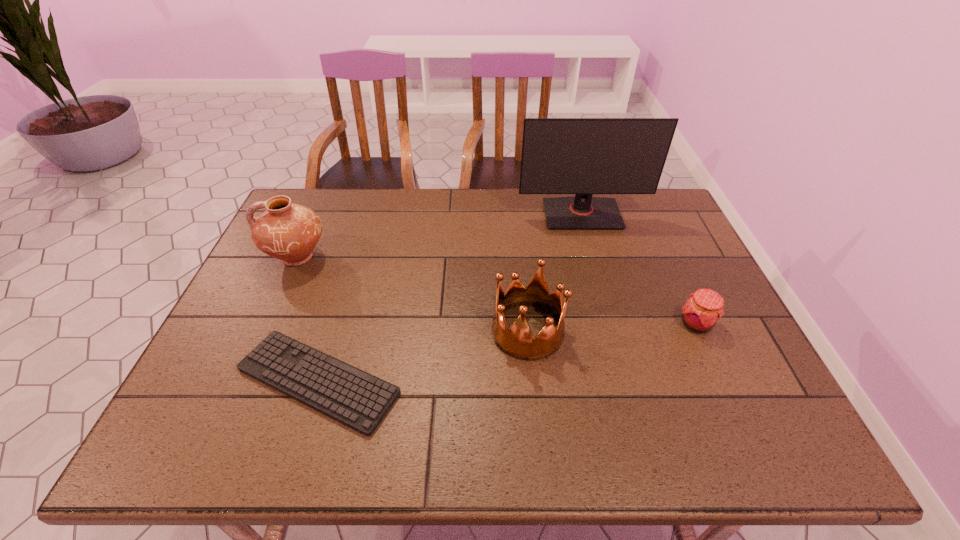
I want to click on object present at the far edge, so click(x=583, y=156).

The width and height of the screenshot is (960, 540). I want to click on object that is at the near edge, so click(x=351, y=396).

Identify the location of pottery at the left edge. The width and height of the screenshot is (960, 540). (286, 231).

The image size is (960, 540). I want to click on computer keyboard at the left edge, so point(351,396).

Identify the location of monitor that is at the right edge. (583, 156).

Identify the location of jam situated at the right edge. (704, 308).

Locate an element on the screen. This screenshot has width=960, height=540. object that is at the near left corner is located at coordinates (351, 396).

Locate an element on the screen. The image size is (960, 540). object located in the far right corner section of the desktop is located at coordinates (583, 156).

Locate an element on the screen. vacant space at the far edge of the desktop is located at coordinates (450, 201).

In the image, there is a desktop. What are the coordinates of `free space at the near edge` in the screenshot? It's located at (706, 423).